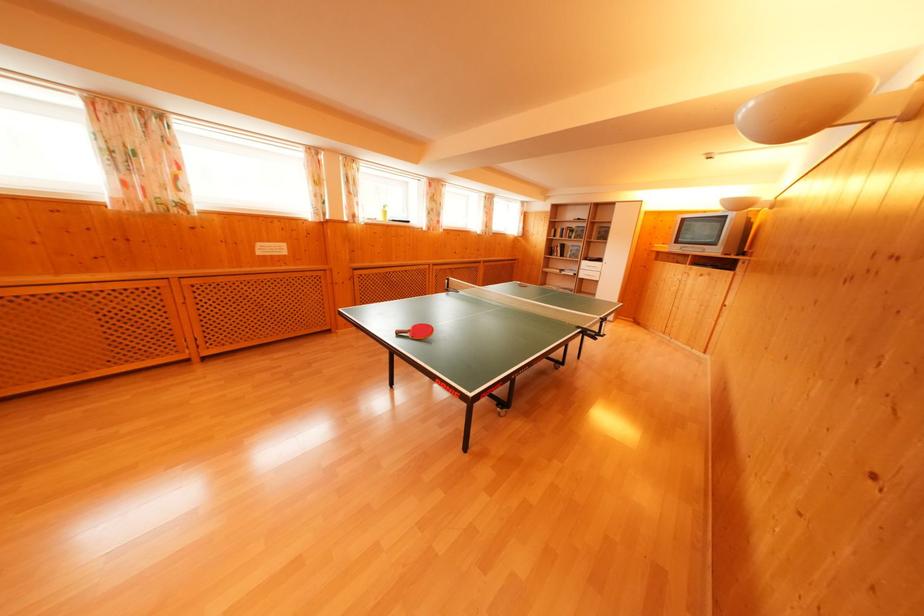
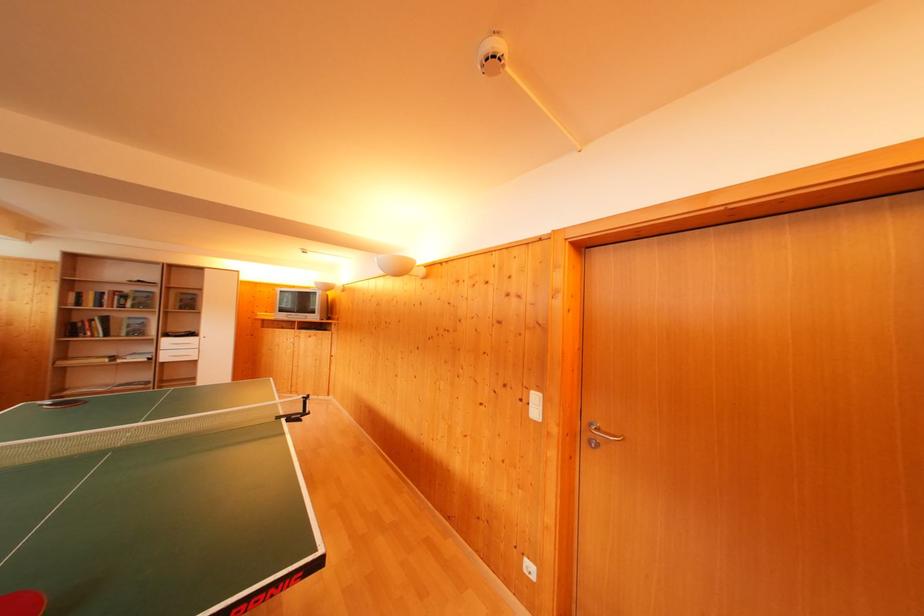
In the second image, find the point that corresponds to (x=578, y=231) in the first image.

(131, 294)